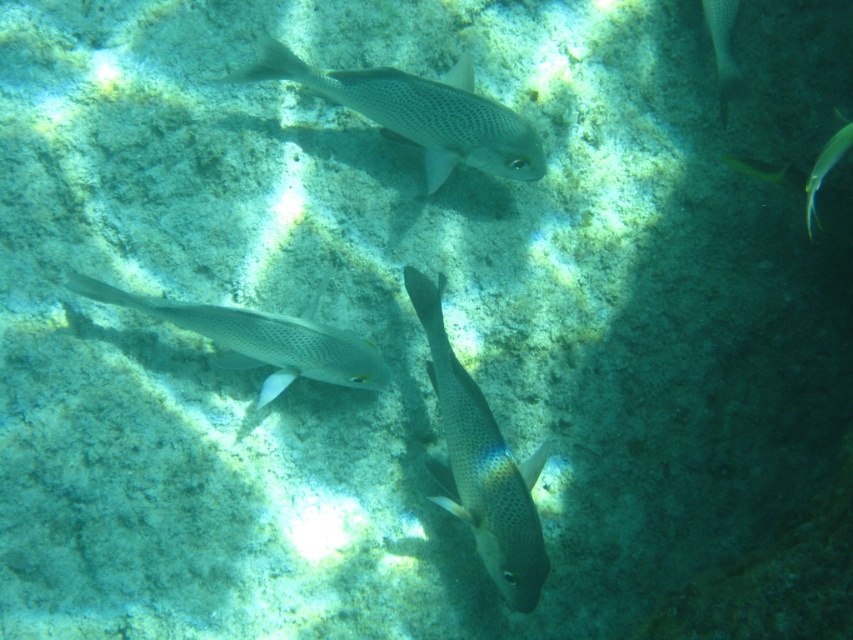
You are a marine biologist observing an underwater scene. You notice a speckled silver fish at upper center. Can you provide the coordinates where this fish is located?

The speckled silver fish at upper center is located at coordinates point (419, 113).

You are a scuba diver swimming underwater and want to take a photo of the shiny silver fish at center and the shiny silver fish at right. Which fish will appear larger in your camera viewfinder?

The shiny silver fish at center will appear larger in the camera viewfinder because it is closer to the viewer than the shiny silver fish at right.